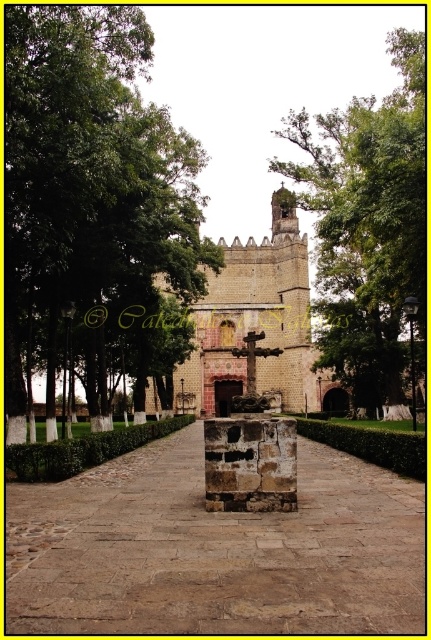
Who is shorter, green leafy tree at upper left or green leafy tree at center?

green leafy tree at upper left is shorter.

Who is more distant from viewer, (119,22) or (417,253)?

The point (417,253) is more distant.

Where is `green leafy tree at upper left`? green leafy tree at upper left is located at coordinates (88, 179).